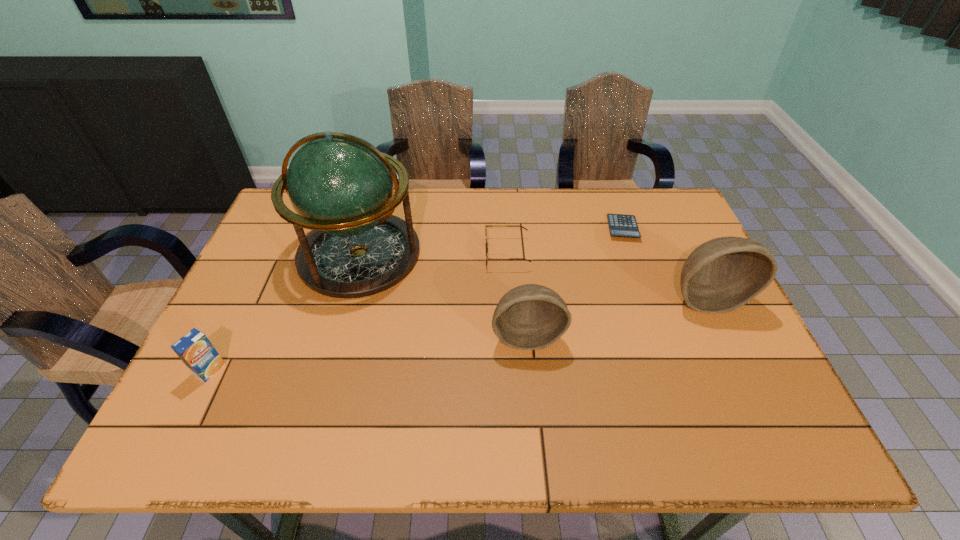
Find the location of a particular element. The height and width of the screenshot is (540, 960). free space between the calculator and the third tallest object is located at coordinates (575, 282).

Image resolution: width=960 pixels, height=540 pixels. Identify the location of vacant area that lies between the shortest object and the fourth tallest object. click(x=417, y=299).

Find the location of a particular element. free space between the second shortest object and the globe is located at coordinates (433, 254).

Identify the location of object that is the fifth closest to the fifth tallest object. (196, 351).

Select which object is the fourth closest to the orange_juice. Please provide its 2D coordinates. Your answer should be formatted as a tuple, i.e. [(x, y)], where the tuple contains the x and y coordinates of a point satisfying the conditions above.

[(621, 225)]

This screenshot has width=960, height=540. What are the coordinates of `blank space that satisfies the following two spatial constraints: 1. on the front-facing side of the second tallest object; 2. on the left side of the tallest object` in the screenshot? It's located at (348, 298).

Locate an element on the screen. free location that satisfies the following two spatial constraints: 1. at the front view of the fifth tallest object; 2. on the front-facing side of the globe is located at coordinates (507, 254).

The image size is (960, 540). In order to click on vacant space that satisfies the following two spatial constraints: 1. on the back side of the left bowl; 2. on the left side of the leftmost object in this screenshot , I will do (x=228, y=335).